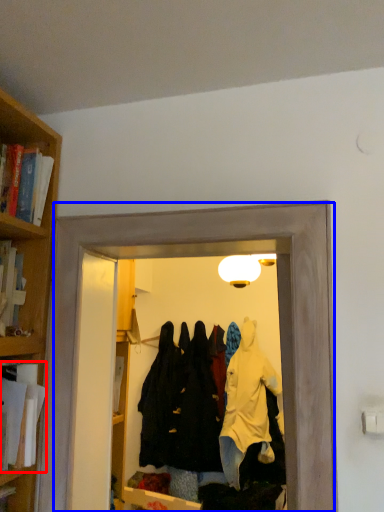
Question: Among these objects, which one is farthest to the camera, book (highlighted by a red box) or glass door (highlighted by a blue box)?

Choices:
 (A) book
 (B) glass door

Answer: (A)